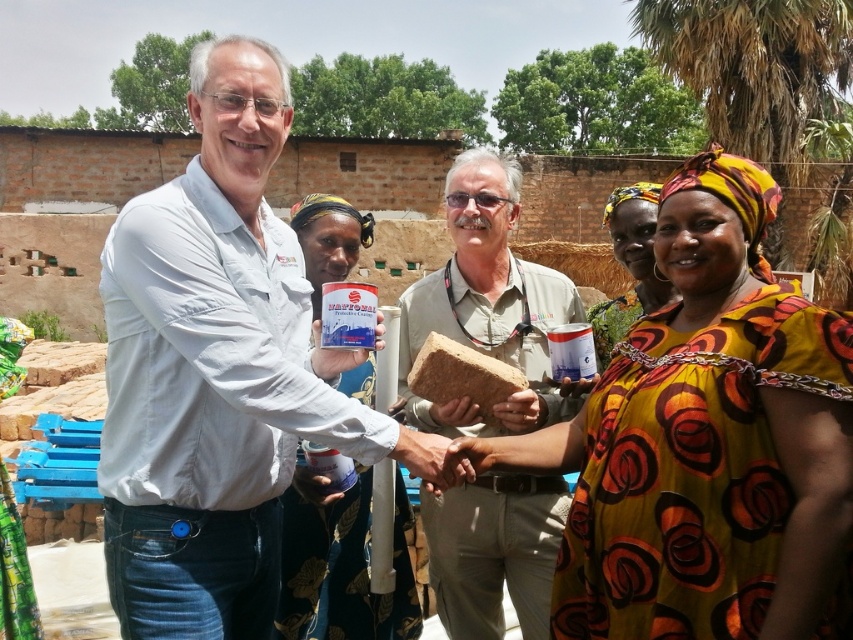
You are a photographer taking a picture of the scene. You notice the white matte shirt at center and the beige fabric shirt at center. Which one is positioned higher in the frame?

The white matte shirt at center is located above the beige fabric shirt at center, so it is positioned higher in the frame.

What is the exact location of the matte plastic container at center in the image?

The matte plastic container at center is located at point coordinates of 0.884 in the x axis and 0.394 in the y axis.